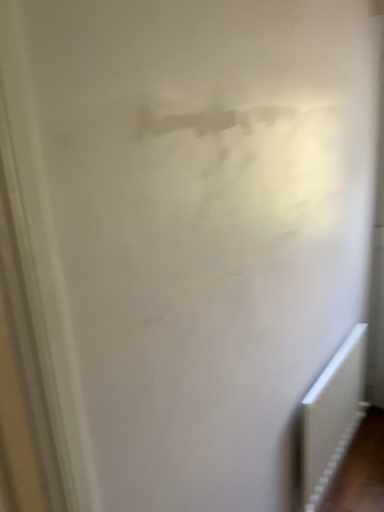
What do you see at coordinates (332, 416) in the screenshot?
I see `white plastic radiator at lower right` at bounding box center [332, 416].

This screenshot has width=384, height=512. I want to click on white plastic radiator at lower right, so click(332, 416).

At what (x,y) coordinates should I click in order to perform the action: click on white plastic radiator at lower right. Please return your answer as a coordinate pair (x, y). This screenshot has height=512, width=384. Looking at the image, I should click on (332, 416).